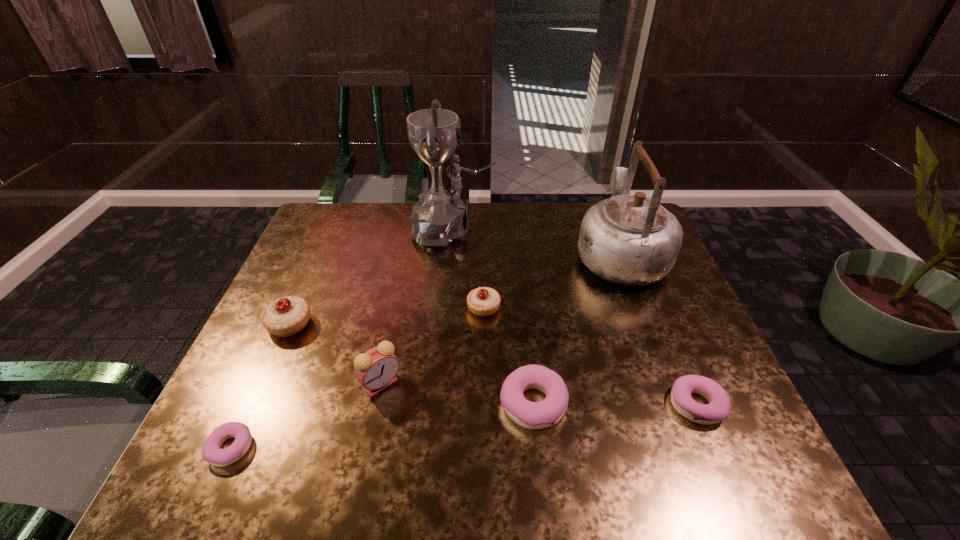
What are the coordinates of `vacant area located 0.360m on the back of the sixth tallest object` in the screenshot? It's located at (519, 274).

Where is `free space located 0.270m on the back of the seventh tallest object`? Image resolution: width=960 pixels, height=540 pixels. free space located 0.270m on the back of the seventh tallest object is located at coordinates (653, 300).

You are a GUI agent. You are given a task and a screenshot of the screen. Output one action in this format:
    pyautogui.click(x=<x>, y=<y>)
    Task: Click on the free space located on the right of the smallest pink pastry
    This screenshot has height=540, width=960.
    Given the screenshot: What is the action you would take?
    pyautogui.click(x=367, y=448)

You are a GUI agent. You are given a task and a screenshot of the screen. Output one action in this format:
    pyautogui.click(x=<x>, y=<y>)
    Task: Click on the award present at the far edge
    The image size is (960, 540).
    Given the screenshot: What is the action you would take?
    pyautogui.click(x=440, y=217)

At what (x,y) coordinates should I click in order to perform the action: click on kettle located at the far edge. Please return your answer as a coordinate pair (x, y). The image size is (960, 540). Looking at the image, I should click on (631, 240).

Where is `object at the near edge`? This screenshot has width=960, height=540. object at the near edge is located at coordinates (212, 453).

Image resolution: width=960 pixels, height=540 pixels. In order to click on kettle located at the right edge in this screenshot , I will do `click(631, 240)`.

Find the location of `pastry at the right edge`. pastry at the right edge is located at coordinates click(x=718, y=409).

This screenshot has height=540, width=960. Identify the location of object that is at the near left corner. (212, 453).

Find the location of a particular element. object that is at the far right corner is located at coordinates point(631,240).